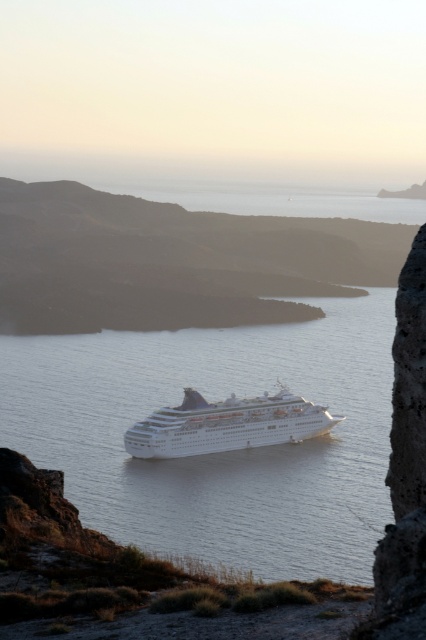
You are standing on the rocky outcrop on the right side of the image. You see the white glossy water at center and the white glossy cruise ship at center. Which object is nearer to you?

The white glossy water at center is closer to the viewer than the white glossy cruise ship at center, so the water is nearer to you.

Consider the image. You are standing at the edge of a cliff overlooking the ocean. You see the white glossy water at center below you. If you want to throw a stone to reach the water, will you need to throw it more than 25 meters?

The white glossy water at center is 26.05 meters away from the viewer. Since 26.05 meters is more than 25 meters, you will need to throw the stone more than 25 meters to reach it.